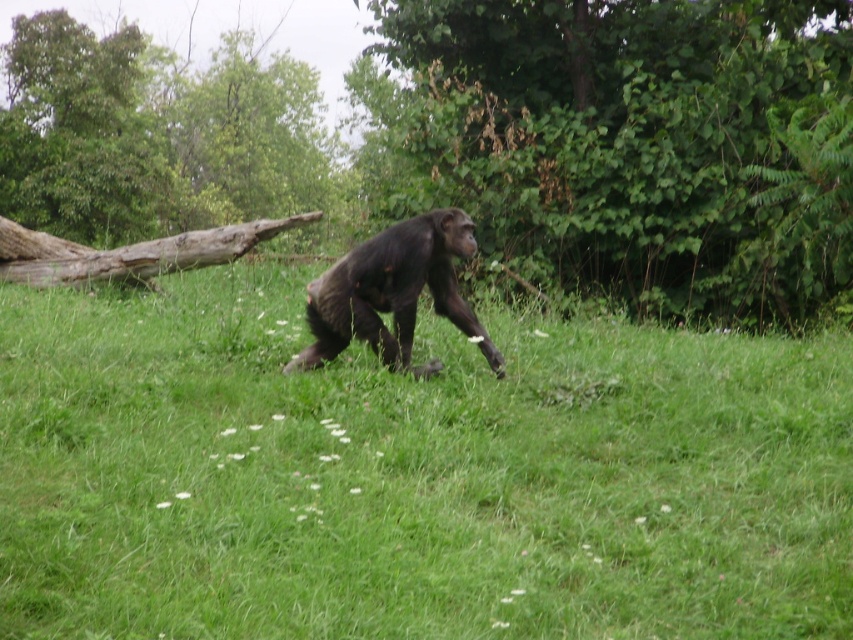
You are a small animal trying to cross the green grassy at center and the brown wood log at left. Which surface would be easier to walk on?

The green grassy at center has a smaller size compared to the brown wood log at left, so it might be easier for a small animal to navigate the grassy area since it is less obstructive.

You are standing in front of the chimpanzee enclosure and see the point at coordinates point (343,593). If you want to throw a banana to that point, which is 4.27 meters away from you, can you estimate whether you can reach it with an average throw of 4 meters?

The point (343,593) is 4.27 meters away from you. Since your average throw is 4 meters, you cannot reach it as the distance is slightly longer than your throwing range.